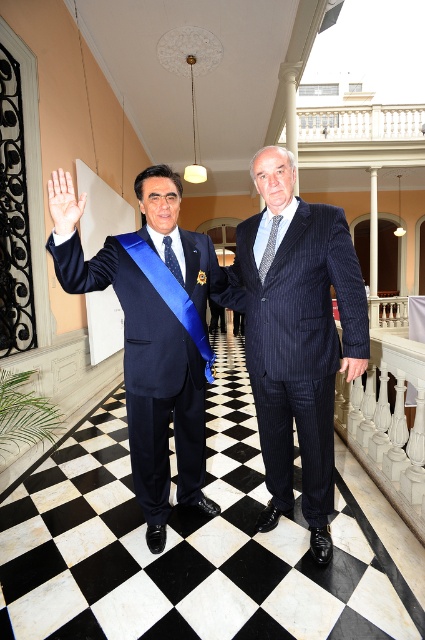
Does dark blue pinstripe suit at center have a lesser width compared to patterned silk tie at center?

No.

Does point (294, 232) lie behind point (261, 273)?

No.

The height and width of the screenshot is (640, 425). I want to click on dark blue pinstripe suit at center, so click(x=297, y=337).

Which is more to the right, matte blue suit at center or smooth skin palm at center?

Positioned to the right is matte blue suit at center.

Is point (147, 284) positioned behind point (53, 196)?

Yes.

Find the location of a particular element. This screenshot has height=640, width=425. matte blue suit at center is located at coordinates (149, 380).

I want to click on matte blue suit at center, so click(x=149, y=380).

Who is shorter, matte blue suit at center or blue silk tie at center?

blue silk tie at center is shorter.

Which is behind, point (90, 266) or point (163, 241)?

The point (163, 241) is behind.

Between point (125, 260) and point (172, 250), which one is positioned behind?

The point (172, 250) is more distant.

Identify the location of matte blue suit at center. This screenshot has height=640, width=425. (149, 380).